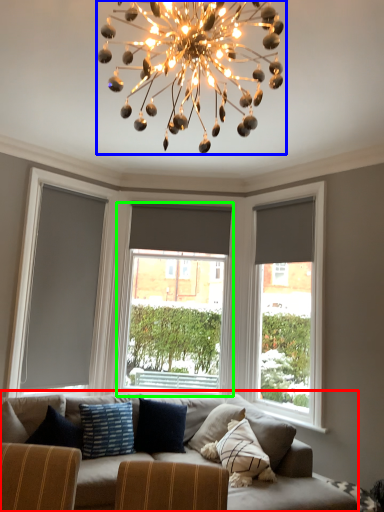
Question: Which is nearer to the studio couch (highlighted by a red box)? chandelier (highlighted by a blue box) or window (highlighted by a green box).

Choices:
 (A) chandelier
 (B) window

Answer: (B)